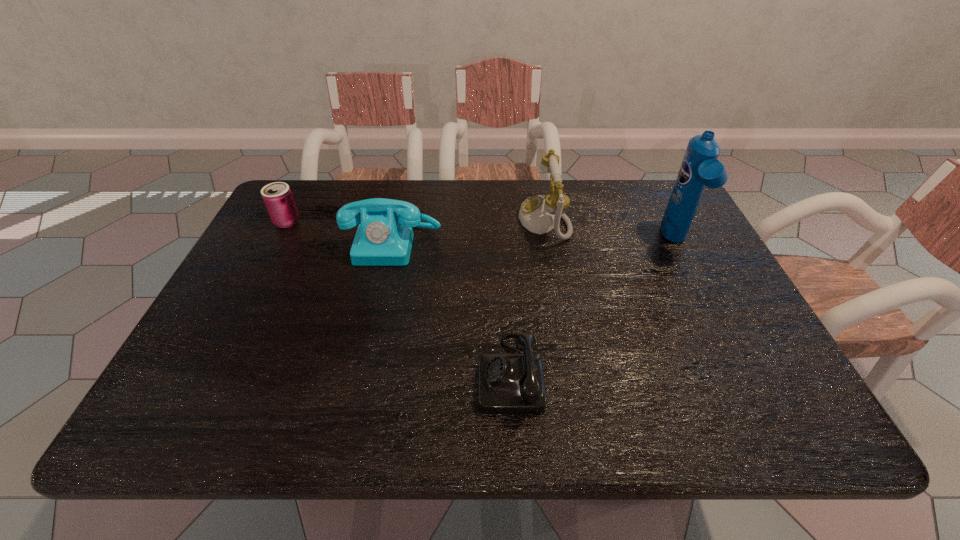
The height and width of the screenshot is (540, 960). What are the coordinates of `object that is the third closest to the fourth object from right to left` in the screenshot? It's located at (508, 383).

Find the location of `object that ranks as the closest to the nearest telephone`. object that ranks as the closest to the nearest telephone is located at coordinates (383, 238).

Find the location of `telephone identified as the closest to the nearest object`. telephone identified as the closest to the nearest object is located at coordinates (383, 238).

You are a GUI agent. You are given a task and a screenshot of the screen. Output one action in this format:
    pyautogui.click(x=<x>, y=<y>)
    Task: Click on the telephone that can be found as the second closest to the can
    
    Given the screenshot: What is the action you would take?
    pyautogui.click(x=539, y=214)

The height and width of the screenshot is (540, 960). Identify the location of free space that satisfies the following two spatial constraints: 1. on the dial of the tallest telephone; 2. on the front side of the leftmost object. (544, 222).

Locate an element on the screen. Image resolution: width=960 pixels, height=540 pixels. vacant region that satisfies the following two spatial constraints: 1. on the dial of the fourth shortest object; 2. on the right side of the shampoo is located at coordinates (548, 241).

At what (x,y) coordinates should I click in order to perform the action: click on free space in the image that satisfies the following two spatial constraints: 1. on the dial of the fourth shortest object; 2. on the back side of the rightmost object. Please return your answer as a coordinate pair (x, y). Looking at the image, I should click on (548, 241).